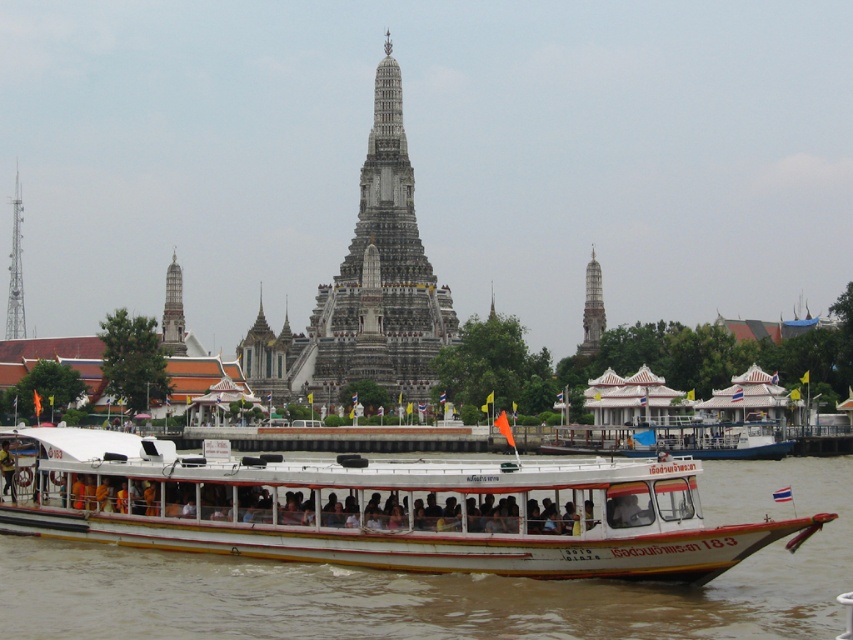
You are a tourist standing on the riverside and want to take a photo of the white stone tower at right and the white matte boat at center. Based on their positions, which object should you point your camera towards first to capture both in the same frame?

The white matte boat at center is below the white stone tower at right, so you should point your camera upwards to include both the white stone tower at right and the white matte boat at center in the same frame.

You are a tourist standing on the riverside and want to take a photo of the white matte boat at center. Where should you position yourself to capture the boat in the center of your photo?

To capture the white matte boat at center in the center of your photo, position yourself directly in line with its 2D coordinates at point (387, 509), ensuring the boat is framed centrally within your camera viewfinder.